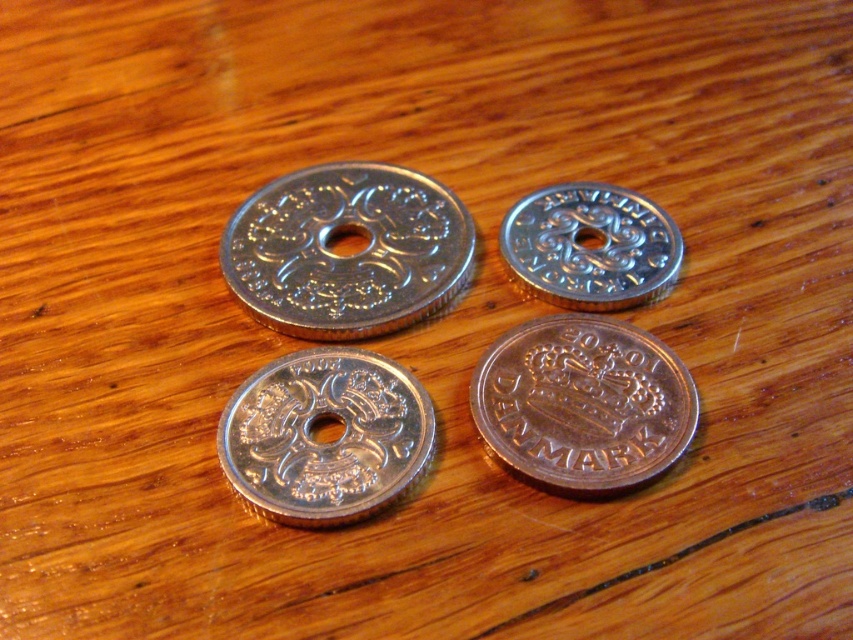
You are arranging coins on a desk and notice the shiny silver coin at bottom right and the silver metallic coin at center. Which coin is closer to you?

The shiny silver coin at bottom right is closer to you because the silver metallic coin at center is behind it.

Based on the photo, you are a coin collector who wants to place a new coin between the shiny silver coin at bottom right and the silver metallic coin at center. The new coin has a diameter of 1 inch. Can you fit it between them without overlapping?

The distance between the shiny silver coin at bottom right and the silver metallic coin at center is 8.04 inches. Since the new coin has a diameter of 1 inch, there is sufficient space to place it between them without overlapping.